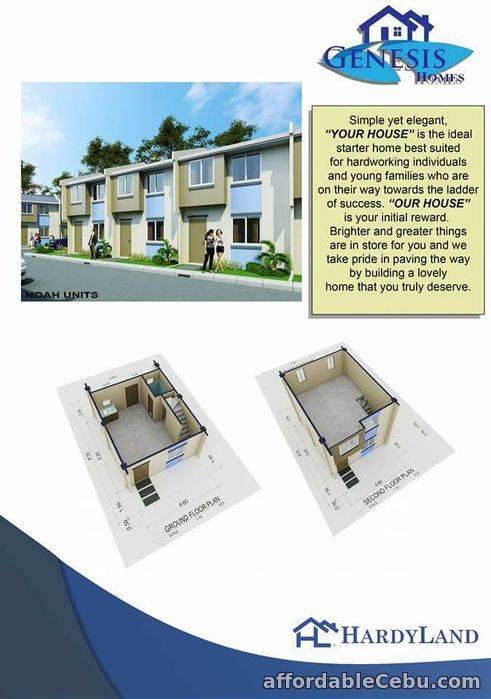
Identify the location of ground floor layout. (143, 440).